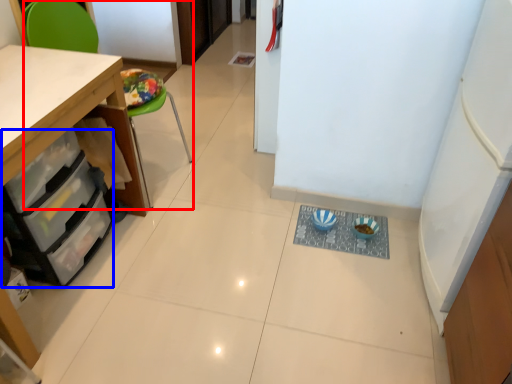
Question: Among these objects, which one is farthest to the camera, chair (highlighted by a red box) or drawer (highlighted by a blue box)?

Choices:
 (A) chair
 (B) drawer

Answer: (A)